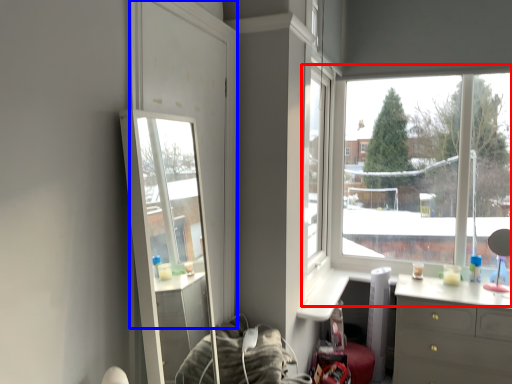
Question: Among these objects, which one is nearest to the camera, window (highlighted by a red box) or glass door (highlighted by a blue box)?

Choices:
 (A) window
 (B) glass door

Answer: (B)